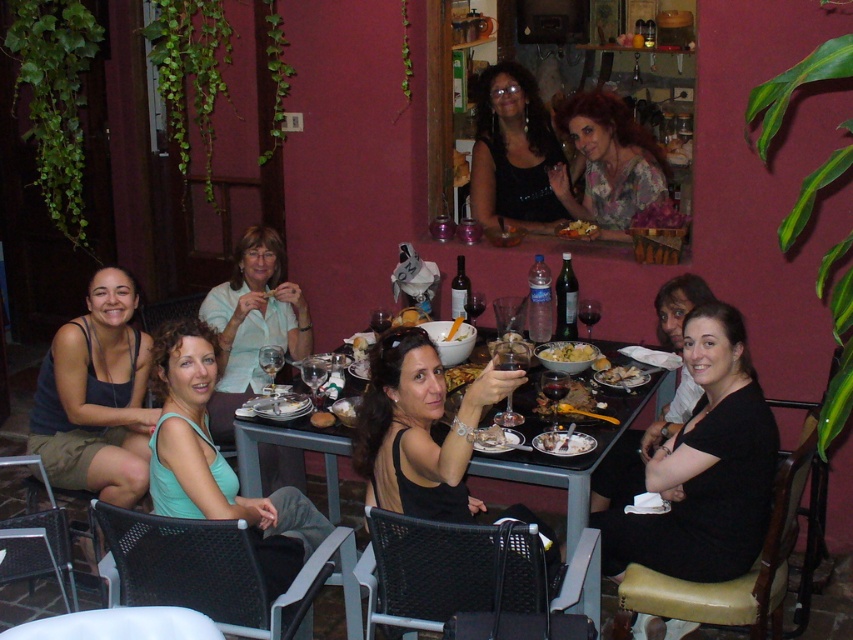
Does wooden table at center have a larger size compared to golden crispy bread at center?

Yes, wooden table at center is bigger than golden crispy bread at center.

Can you confirm if wooden table at center is shorter than golden crispy bread at center?

In fact, wooden table at center may be taller than golden crispy bread at center.

Locate an element on the screen. wooden table at center is located at coordinates (570, 464).

Who is positioned more to the left, black matte dress at center or shiny silver bowl at center?

black matte dress at center

Which is in front, point (448, 435) or point (605, 376)?

Point (448, 435) is more forward.

Find the location of a particular element. The width and height of the screenshot is (853, 640). black matte dress at center is located at coordinates (421, 429).

Between point (614, 412) and point (502, 433), which one is positioned behind?

The point (614, 412) is more distant.

The height and width of the screenshot is (640, 853). In order to click on wooden table at center in this screenshot , I will do `click(570, 464)`.

Is point (569, 531) positioned before point (479, 440)?

Yes, it is.

Image resolution: width=853 pixels, height=640 pixels. In order to click on wooden table at center in this screenshot , I will do `click(570, 464)`.